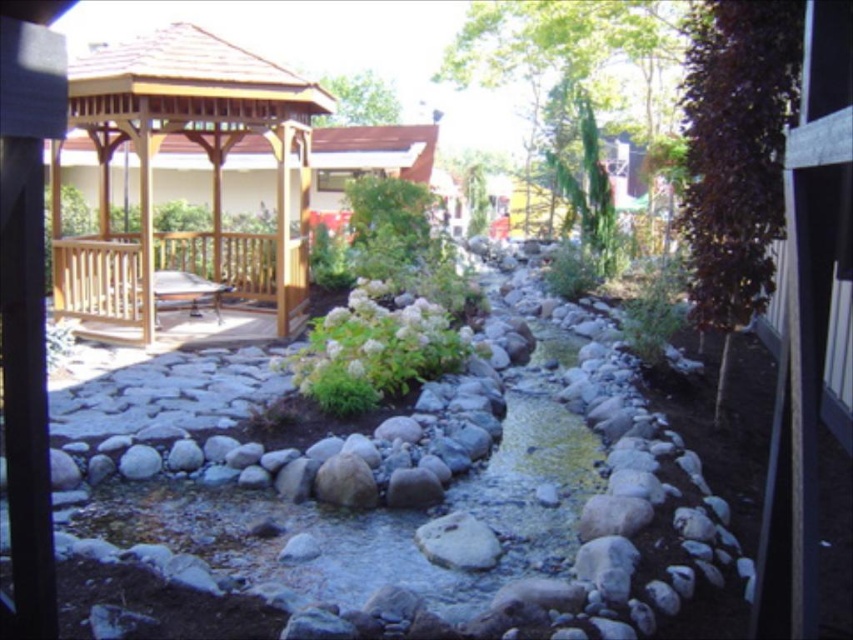
You are standing in the garden and want to place a small decorative statue between the two points, point [177,252] and point [381,317]. Which point should the statue be closer to in order to be nearer to the camera?

The statue should be closer to point [177,252] because it is further to the camera than point [381,317].

You are standing in the garden and want to walk from the wooden gazebo at upper left to the white fluffy bush at center. Which direction should you move relative to the gazebo?

You should move towards the center of the garden away from the wooden gazebo at upper left since the white fluffy bush at center is closer to the viewer than the gazebo.

You are planning to install a new lighting system in the garden. The wooden gazebo at upper left and the white fluffy bush at center are both in the path of the proposed light fixtures. Which object would require taller light poles to avoid obstruction?

The white fluffy bush at center requires taller light poles because it is taller than the wooden gazebo at upper left.